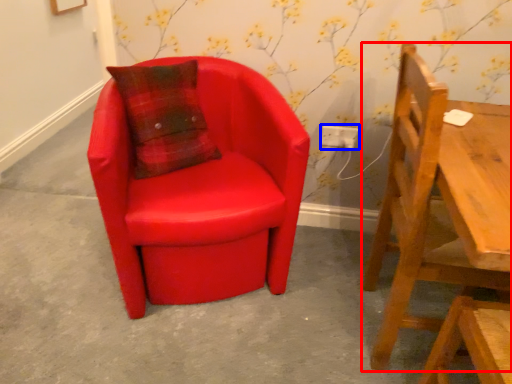
Question: Which object appears farthest to the camera in this image, chair (highlighted by a red box) or electric outlet (highlighted by a blue box)?

Choices:
 (A) chair
 (B) electric outlet

Answer: (B)